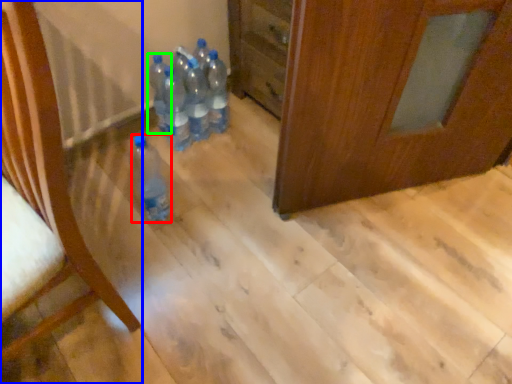
Question: Based on their relative distances, which object is farther from bottle (highlighted by a red box)? Choose from furniture (highlighted by a blue box) and bottle (highlighted by a green box).

Choices:
 (A) furniture
 (B) bottle

Answer: (A)